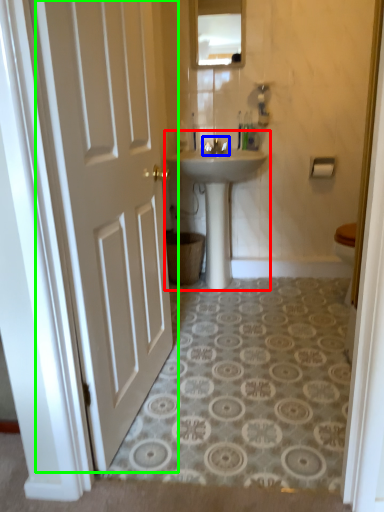
Question: Considering the real-world distances, which object is closest to sink (highlighted by a red box)? tap (highlighted by a blue box) or door (highlighted by a green box).

Choices:
 (A) tap
 (B) door

Answer: (A)